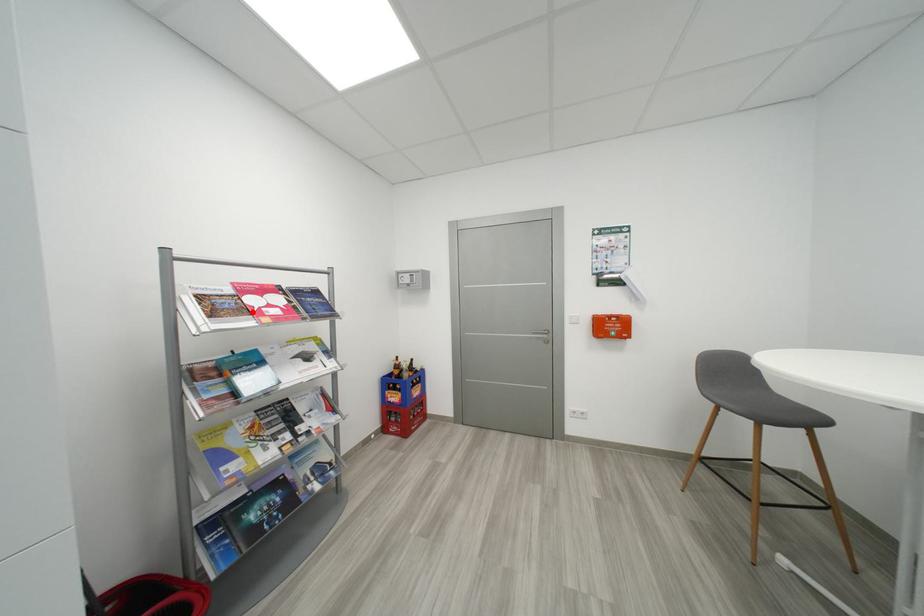
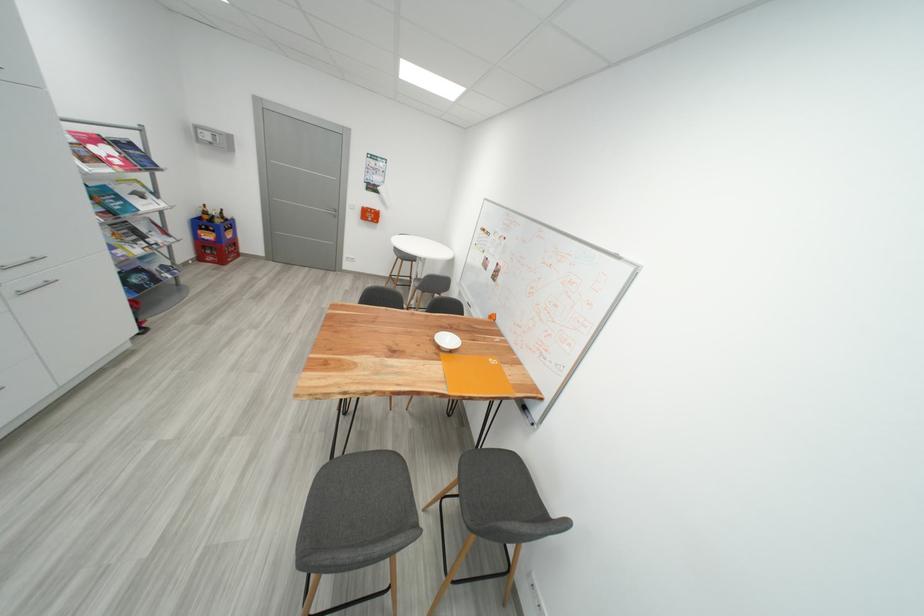
Find the pixel in the second image that matches the highlighted location in the first image.

(104, 161)